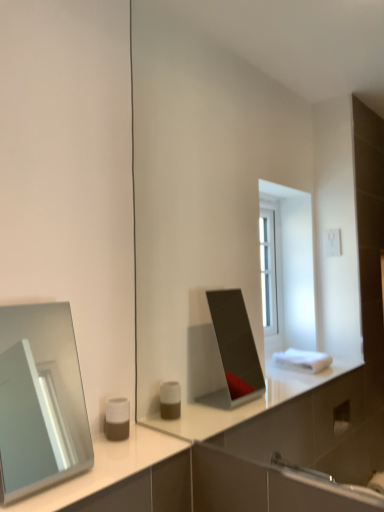
This screenshot has height=512, width=384. What are the coordinates of `matte white and brown cylindrical container at lower left` in the screenshot? It's located at (117, 419).

Measure the distance between matte white and brown cylindrical container at lower left and camera.

matte white and brown cylindrical container at lower left and camera are 3.94 feet apart from each other.

Measure the distance between point [112,438] and camera.

Point [112,438] and camera are 3.95 feet apart from each other.

The width and height of the screenshot is (384, 512). Describe the element at coordinates (117, 419) in the screenshot. I see `matte white and brown cylindrical container at lower left` at that location.

What do you see at coordinates (40, 400) in the screenshot?
I see `silver metallic mirror at left` at bounding box center [40, 400].

Find the location of `silver metallic mirror at left`. silver metallic mirror at left is located at coordinates (40, 400).

I want to click on matte white and brown cylindrical container at lower left, so click(117, 419).

Which object is positioned more to the left, silver metallic mirror at left or matte white and brown cylindrical container at lower left?

silver metallic mirror at left.

Is the depth of silver metallic mirror at left greater than that of matte white and brown cylindrical container at lower left?

No, it is in front of matte white and brown cylindrical container at lower left.

Which point is more distant from viewer, (0, 459) or (125, 432)?

Point (0, 459)

From the image's perspective, which is below, silver metallic mirror at left or matte white and brown cylindrical container at lower left?

matte white and brown cylindrical container at lower left is shown below in the image.

From a real-world perspective, is silver metallic mirror at left positioned above or below matte white and brown cylindrical container at lower left?

From a real-world perspective, silver metallic mirror at left is physically above matte white and brown cylindrical container at lower left.

Between silver metallic mirror at left and matte white and brown cylindrical container at lower left, which one has larger width?

With larger width is silver metallic mirror at left.

Based on the photo, does silver metallic mirror at left have a greater height compared to matte white and brown cylindrical container at lower left?

Correct, silver metallic mirror at left is much taller as matte white and brown cylindrical container at lower left.

Considering the relative sizes of silver metallic mirror at left and matte white and brown cylindrical container at lower left in the image provided, is silver metallic mirror at left bigger than matte white and brown cylindrical container at lower left?

Yes.

Is matte white and brown cylindrical container at lower left a part of silver metallic mirror at left?

No, matte white and brown cylindrical container at lower left is not surrounded by silver metallic mirror at left.

Is silver metallic mirror at left next to matte white and brown cylindrical container at lower left and touching it?

No, silver metallic mirror at left is not touching matte white and brown cylindrical container at lower left.

Is silver metallic mirror at left oriented towards matte white and brown cylindrical container at lower left?

No, silver metallic mirror at left is not oriented towards matte white and brown cylindrical container at lower left.

Find the location of `mirror in front of the matte white and brown cylindrical container at lower left`. mirror in front of the matte white and brown cylindrical container at lower left is located at coordinates (40, 400).

Considering the relative positions of matte white and brown cylindrical container at lower left and silver metallic mirror at left in the image provided, is matte white and brown cylindrical container at lower left to the right of silver metallic mirror at left from the viewer's perspective?

Yes, matte white and brown cylindrical container at lower left is to the right of silver metallic mirror at left.

Is matte white and brown cylindrical container at lower left in front of silver metallic mirror at left?

No, matte white and brown cylindrical container at lower left is behind silver metallic mirror at left.

Considering the points (114, 411) and (15, 478), which point is in front, point (114, 411) or point (15, 478)?

The point (114, 411) is closer to the camera.

From the image's perspective, is matte white and brown cylindrical container at lower left above silver metallic mirror at left?

No, from the image's perspective, matte white and brown cylindrical container at lower left is not above silver metallic mirror at left.

From a real-world perspective, which object rests below the other?

In real-world perspective, matte white and brown cylindrical container at lower left is lower.

Is matte white and brown cylindrical container at lower left wider than silver metallic mirror at left?

Incorrect, the width of matte white and brown cylindrical container at lower left does not surpass that of silver metallic mirror at left.

Considering the relative sizes of matte white and brown cylindrical container at lower left and silver metallic mirror at left in the image provided, is matte white and brown cylindrical container at lower left shorter than silver metallic mirror at left?

Indeed, matte white and brown cylindrical container at lower left has a lesser height compared to silver metallic mirror at left.

Which of these two, matte white and brown cylindrical container at lower left or silver metallic mirror at left, is smaller?

matte white and brown cylindrical container at lower left is smaller.

Is matte white and brown cylindrical container at lower left spatially inside silver metallic mirror at left, or outside of it?

matte white and brown cylindrical container at lower left is located beyond the bounds of silver metallic mirror at left.

Looking at this image, is matte white and brown cylindrical container at lower left with silver metallic mirror at left?

No, matte white and brown cylindrical container at lower left is not with silver metallic mirror at left.

Is matte white and brown cylindrical container at lower left oriented towards silver metallic mirror at left?

No.

How many degrees apart are the facing directions of matte white and brown cylindrical container at lower left and silver metallic mirror at left?

0.486 degrees separate the facing orientations of matte white and brown cylindrical container at lower left and silver metallic mirror at left.

This screenshot has height=512, width=384. I want to click on mirror that is above the matte white and brown cylindrical container at lower left (from a real-world perspective), so click(40, 400).

The image size is (384, 512). In the image, there is a silver metallic mirror at left. Find the location of `toiletry below it (from a real-world perspective)`. toiletry below it (from a real-world perspective) is located at coordinates (117, 419).

Image resolution: width=384 pixels, height=512 pixels. I want to click on toiletry lying on the right of silver metallic mirror at left, so click(x=117, y=419).